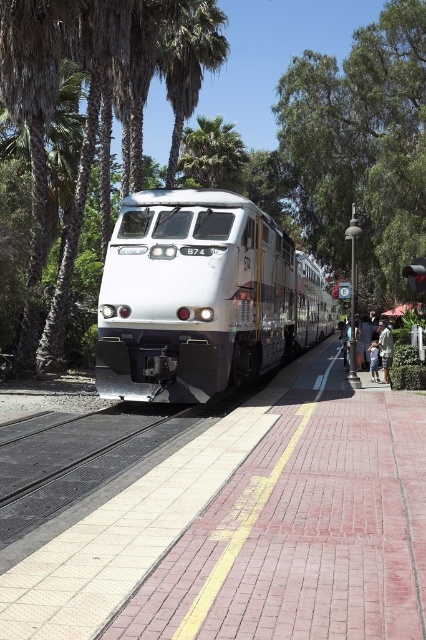
Measure the distance from green leafy tree at upper center to light brown textured shirt at right.

A distance of 33.46 feet exists between green leafy tree at upper center and light brown textured shirt at right.

Does point (362, 65) lie in front of point (383, 364)?

No, it is not.

This screenshot has height=640, width=426. Identify the location of green leafy tree at upper center. (362, 145).

Image resolution: width=426 pixels, height=640 pixels. Find the location of `green leafy tree at upper center`. green leafy tree at upper center is located at coordinates (362, 145).

Who is more forward, (43, 220) or (386, 376)?

Point (43, 220) is more forward.

Who is more forward, (51, 314) or (374, 339)?

Point (51, 314) is more forward.

Identify the location of green leafy tree at center. (92, 109).

Does green leafy palm tree at center appear on the right side of light brown textured shirt at right?

No, green leafy palm tree at center is not to the right of light brown textured shirt at right.

Measure the distance between point (238, 140) and camera.

Point (238, 140) and camera are 34.52 meters apart.

What do you see at coordinates (212, 156) in the screenshot? I see `green leafy palm tree at center` at bounding box center [212, 156].

The image size is (426, 640). I want to click on green leafy palm tree at center, so click(x=212, y=156).